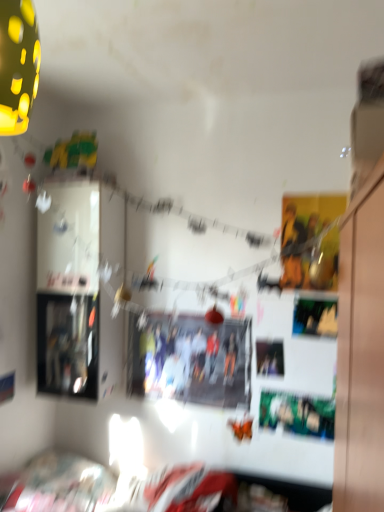
Question: Should I look upward or downward to see matte black photo frame at center?

Choices:
 (A) up
 (B) down

Answer: (B)